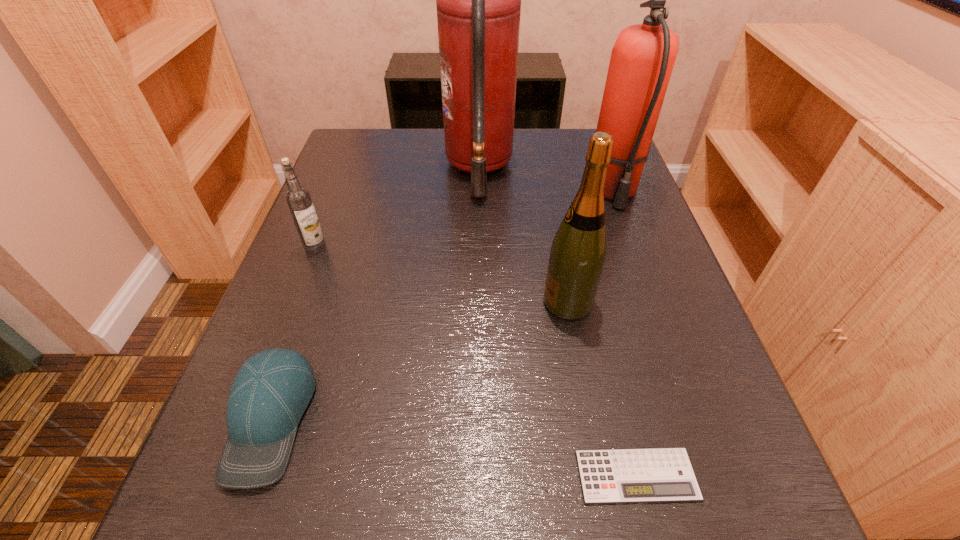
You are a GUI agent. You are given a task and a screenshot of the screen. Output one action in this format:
    pyautogui.click(x=<x>, y=<y>)
    Task: Click on the free space at the far right corner of the desktop
    Image resolution: width=960 pixels, height=540 pixels.
    Given the screenshot: What is the action you would take?
    pyautogui.click(x=568, y=139)

At what (x,y) coordinates should I click in order to perform the action: click on vacant area at the near right corner. Please return your answer as a coordinate pair (x, y). The height and width of the screenshot is (540, 960). Looking at the image, I should click on (767, 511).

Image resolution: width=960 pixels, height=540 pixels. Find the location of `vacant area that lies between the fourth farthest object and the vodka`. vacant area that lies between the fourth farthest object and the vodka is located at coordinates (442, 275).

Find the location of `free point between the baseball cap and the fourth nearest object`. free point between the baseball cap and the fourth nearest object is located at coordinates (293, 333).

I want to click on free point between the right fire extinguisher and the vodka, so click(464, 219).

The image size is (960, 540). In order to click on unoccupied position between the shortest object and the right fire extinguisher in this screenshot , I will do `click(624, 333)`.

In order to click on vacant region between the calculator and the right fire extinguisher in this screenshot , I will do `click(624, 333)`.

Find the location of a particular element. The image size is (960, 540). vacant area between the vodka and the right fire extinguisher is located at coordinates (464, 219).

The height and width of the screenshot is (540, 960). I want to click on empty space between the calculator and the left fire extinguisher, so click(558, 322).

You are a GUI agent. You are given a task and a screenshot of the screen. Output one action in this format:
    pyautogui.click(x=<x>, y=<y>)
    Task: Click on the free space between the right fire extinguisher and the calculator
    This screenshot has height=540, width=960.
    Given the screenshot: What is the action you would take?
    pyautogui.click(x=624, y=333)